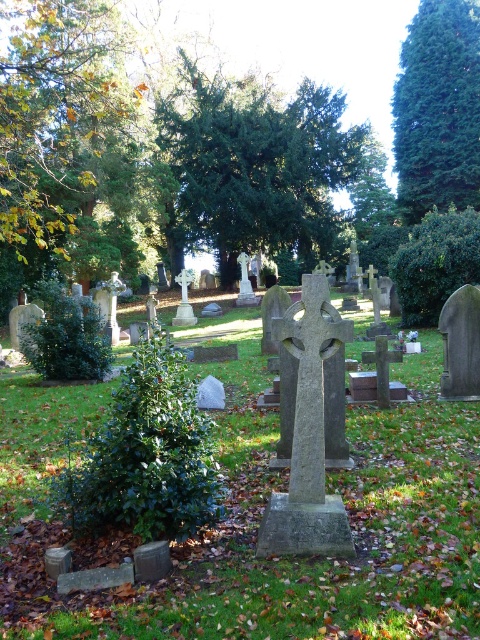
Question: Estimate the real-world distances between objects in this image. Which object is farther from the green grassy at center?

Choices:
 (A) green leafy tree at upper left
 (B) green textured tree at upper right
 (C) green leafy tree at center

Answer: (C)

Question: In this image, where is green grassy at center located relative to green textured tree at upper right?

Choices:
 (A) right
 (B) left

Answer: (B)

Question: Is green leafy tree at center bigger than green leafy tree at upper left?

Choices:
 (A) no
 (B) yes

Answer: (B)

Question: Based on their relative distances, which object is farther from the green textured tree at upper right?

Choices:
 (A) green leafy tree at upper left
 (B) green leafy tree at center
 (C) green grassy at center

Answer: (C)

Question: Is green leafy tree at center closer to the viewer compared to green leafy tree at upper left?

Choices:
 (A) no
 (B) yes

Answer: (A)

Question: Among these points, which one is nearest to the camera?

Choices:
 (A) (371, 154)
 (B) (66, 4)
 (C) (445, 88)
 (D) (430, 362)

Answer: (D)